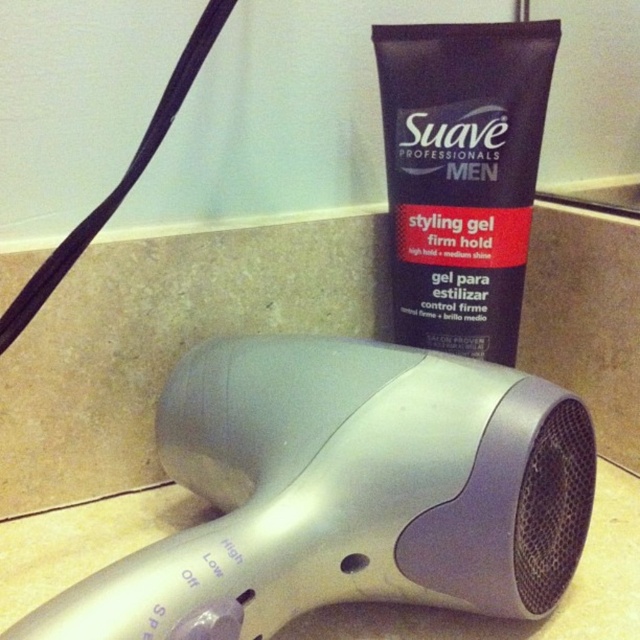
You are a delivery person who needs to place a new package between the silver plastic hair dryer at lower center and the dark blue matte tube at upper center. The package is 12 inches long. Can you fit it between them?

The distance between the silver plastic hair dryer at lower center and the dark blue matte tube at upper center is 13.64 inches, so the 12 inch package can fit between them since it is shorter than the available space.

You are organizing a bathroom counter and need to place both the silver plastic hair dryer at lower center and the dark blue matte tube at upper center. Since you want to arrange items by size, which object should you place first in the larger space?

The silver plastic hair dryer at lower center should be placed first in the larger space because it is larger in size than the dark blue matte tube at upper center.